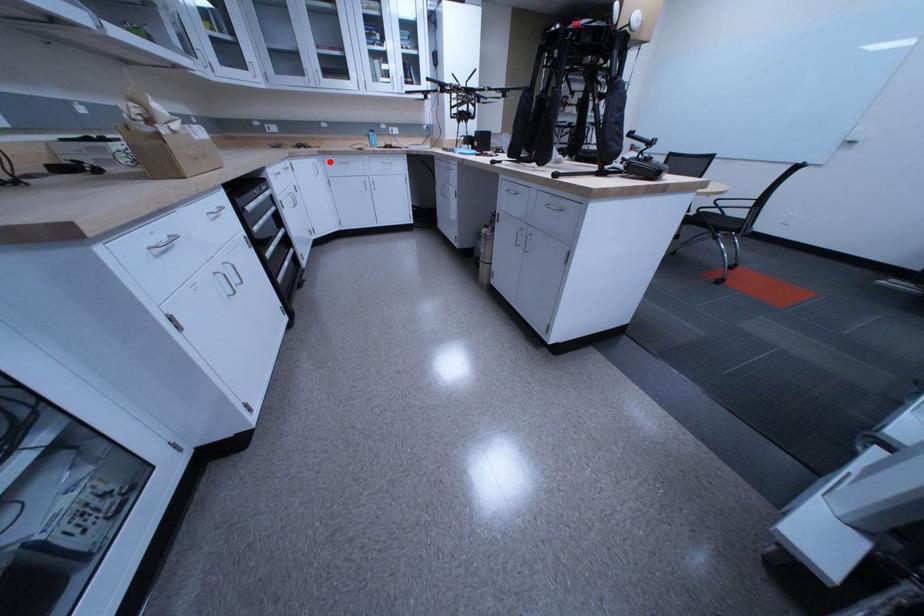
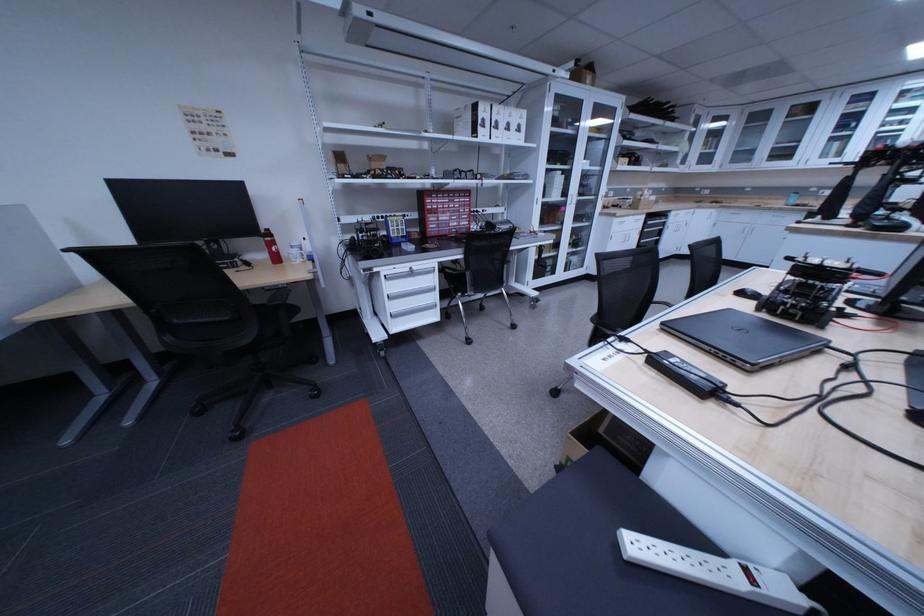
The point at the highlighted location is marked in the first image. Where is the corresponding point in the second image?

(728, 212)